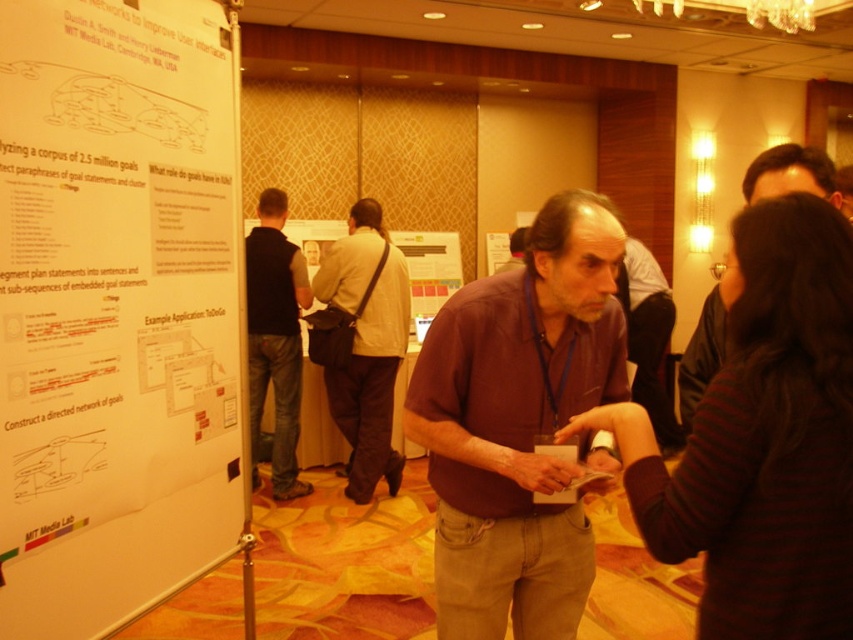
You are organizing a small event and need to place a decorative vase between the white paper at left and the dark brown leather jacket at center. The vase is 2 feet wide. Is there enough space between them to place the vase without moving either object?

The white paper at left is 4.60 feet away from the dark brown leather jacket at center. Since the vase is 2 feet wide, there is sufficient space between them to place the vase without moving either object.

You are standing in the conference room and see two points marked in the scene. Which point is closer to you, point (47, 403) or point (248, 371)?

Point (47, 403) is in front of point (248, 371), so it is closer to you.